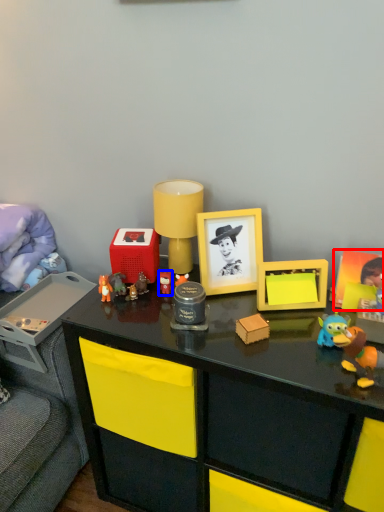
Question: Which of the following is the closest to the observer, picture frame (highlighted by a red box) or toy (highlighted by a blue box)?

Choices:
 (A) picture frame
 (B) toy

Answer: (A)